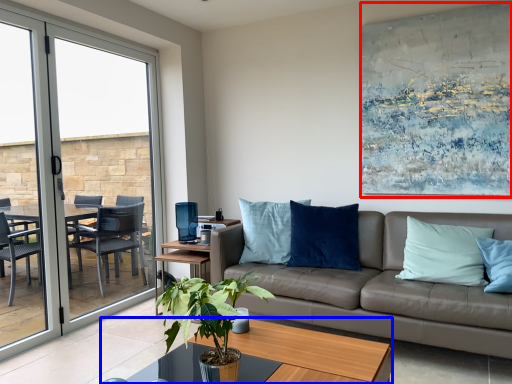
Question: Which object is closer to the camera taking this photo, picture frame (highlighted by a red box) or coffee table (highlighted by a blue box)?

Choices:
 (A) picture frame
 (B) coffee table

Answer: (B)